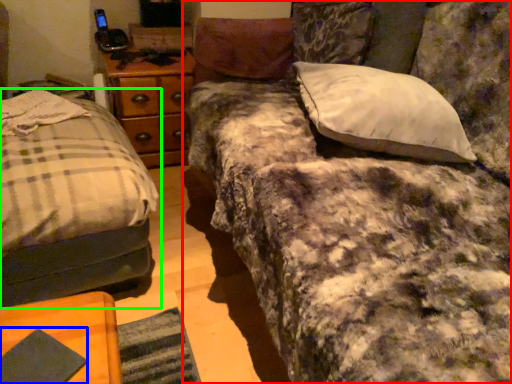
Question: Based on their relative distances, which object is farther from studio couch (highlighted by a red box)? Choose from pad (highlighted by a blue box) and bed (highlighted by a green box).

Choices:
 (A) pad
 (B) bed

Answer: (A)